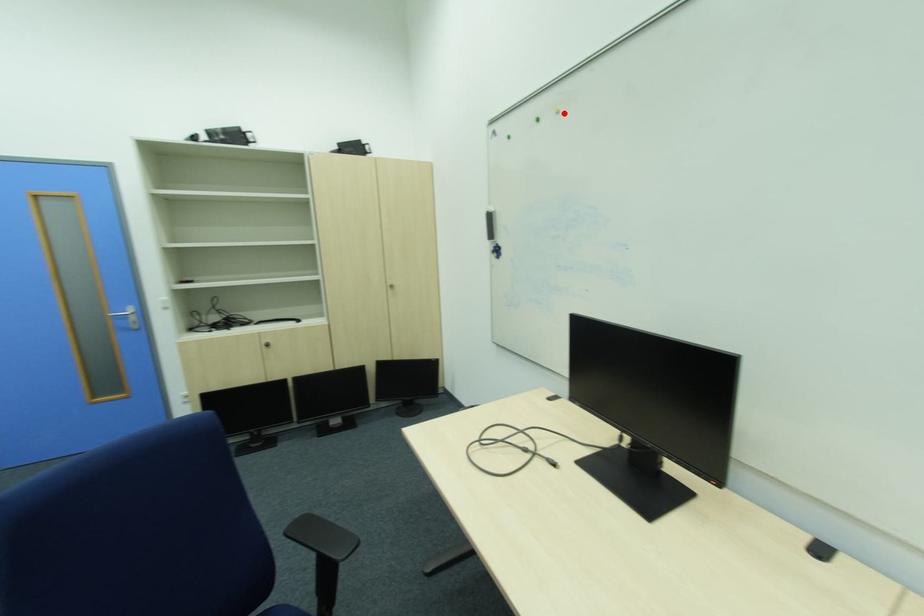
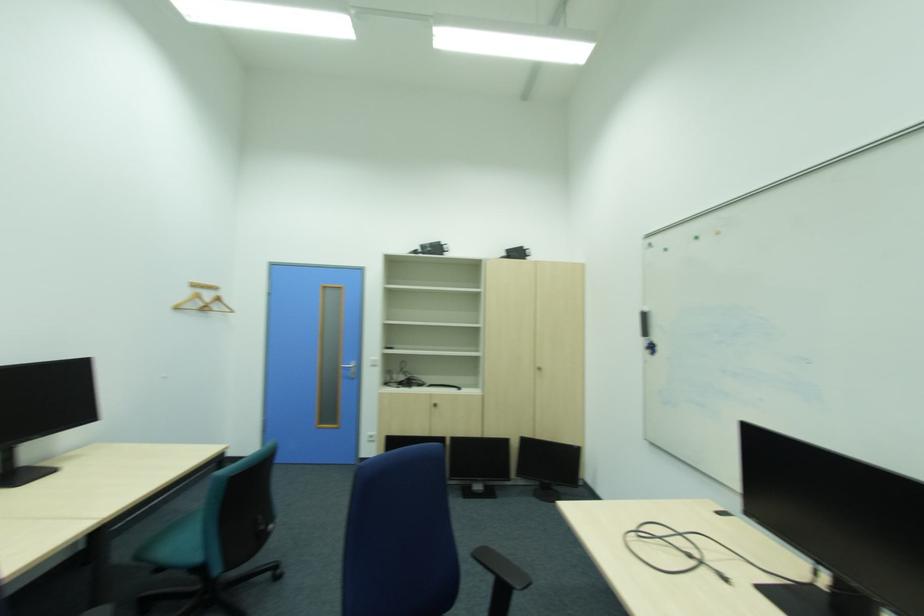
The point at the highlighted location is marked in the first image. Where is the corresponding point in the second image?

(725, 233)